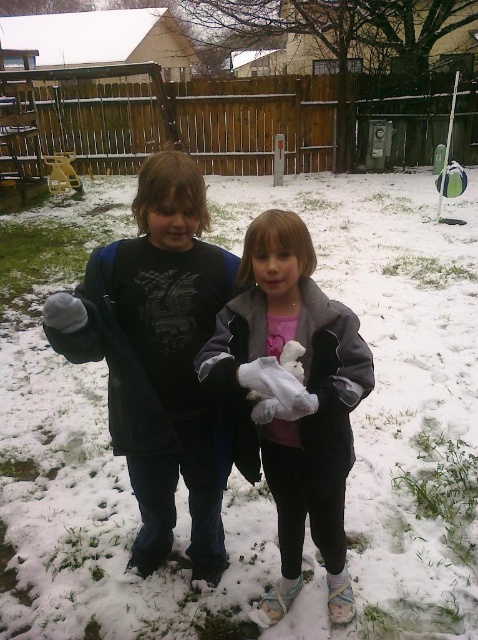
Who is taller, white fluffy snow at center or metallic yellow slide at left?

white fluffy snow at center

Is white fluffy snow at center behind metallic yellow slide at left?

No, it is in front of metallic yellow slide at left.

The height and width of the screenshot is (640, 478). What do you see at coordinates (392, 396) in the screenshot? I see `white fluffy snow at center` at bounding box center [392, 396].

This screenshot has width=478, height=640. Find the location of `white fluffy snow at center`. white fluffy snow at center is located at coordinates (392, 396).

Can you confirm if gray fleece jacket at center is positioned to the right of white fluffy stuffed animal at center?

Indeed, gray fleece jacket at center is positioned on the right side of white fluffy stuffed animal at center.

The image size is (478, 640). Describe the element at coordinates (293, 397) in the screenshot. I see `gray fleece jacket at center` at that location.

The width and height of the screenshot is (478, 640). In order to click on gray fleece jacket at center in this screenshot , I will do `click(293, 397)`.

Between black fleece jacket at center and white fluffy stuffed animal at center, which one has less height?

white fluffy stuffed animal at center

Does black fleece jacket at center come in front of white fluffy stuffed animal at center?

No, black fleece jacket at center is behind white fluffy stuffed animal at center.

Between point (121, 388) and point (246, 380), which one is positioned behind?

Point (121, 388)

Find the location of a particular element. This screenshot has height=640, width=478. black fleece jacket at center is located at coordinates (159, 358).